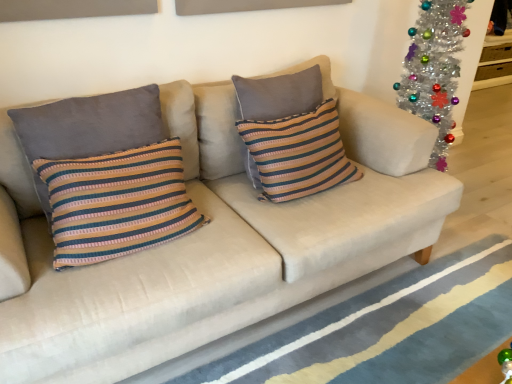
Question: From a real-world perspective, is striped fabric pillow at left, acting as the first pillow starting from the left, physically located above or below blue striped rug at lower center?

Choices:
 (A) above
 (B) below

Answer: (A)

Question: Is point (138, 142) positioned closer to the camera than point (472, 291)?

Choices:
 (A) closer
 (B) farther

Answer: (A)

Question: Which of these objects is positioned closest to the striped fabric pillow at left, which is the second pillow in right-to-left order?

Choices:
 (A) blue striped rug at lower center
 (B) striped fabric pillow at center, positioned as the 1th pillow in right-to-left order

Answer: (B)

Question: Which of these objects is positioned closest to the striped fabric pillow at left, acting as the first pillow starting from the left?

Choices:
 (A) blue striped rug at lower center
 (B) striped fabric pillow at center, positioned as the 1th pillow in right-to-left order

Answer: (B)